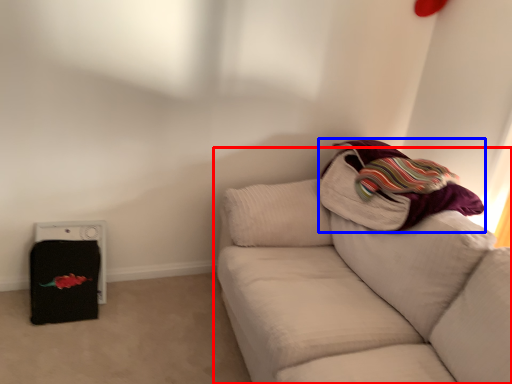
Question: Which object appears closest to the camera in this image, studio couch (highlighted by a red box) or blanket (highlighted by a blue box)?

Choices:
 (A) studio couch
 (B) blanket

Answer: (A)